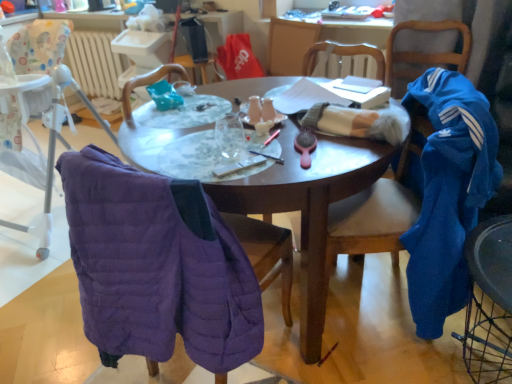
Question: Is velvet blue chair at right, arranged as the fourth chair when viewed from the left, wider than blue fleece jacket at right, the third chair viewed from the left?

Choices:
 (A) no
 (B) yes

Answer: (B)

Question: Is velvet blue chair at right, arranged as the fourth chair when viewed from the left, thinner than blue fleece jacket at right, positioned as the third chair in right-to-left order?

Choices:
 (A) no
 (B) yes

Answer: (A)

Question: From a real-world perspective, is velvet blue chair at right, which ranks as the 2th chair in right-to-left order, below blue fleece jacket at right, positioned as the third chair in right-to-left order?

Choices:
 (A) no
 (B) yes

Answer: (B)

Question: Is the depth of velvet blue chair at right, which ranks as the 2th chair in right-to-left order, greater than that of blue fleece jacket at right, positioned as the third chair in right-to-left order?

Choices:
 (A) yes
 (B) no

Answer: (B)

Question: Is velvet blue chair at right, which ranks as the 2th chair in right-to-left order, oriented away from blue fleece jacket at right, the third chair viewed from the left?

Choices:
 (A) no
 (B) yes

Answer: (A)

Question: Considering their positions, is red fabric bag at center located in front of or behind purple quilted jacket at left, which is counted as the 2th chair, starting from the left?

Choices:
 (A) behind
 (B) front

Answer: (A)

Question: Would you say red fabric bag at center is inside or outside purple quilted jacket at left, the 4th chair in the right-to-left sequence?

Choices:
 (A) outside
 (B) inside

Answer: (A)

Question: From a real-world perspective, is red fabric bag at center positioned above or below purple quilted jacket at left, which is counted as the 2th chair, starting from the left?

Choices:
 (A) below
 (B) above

Answer: (B)

Question: Based on their sizes in the image, would you say red fabric bag at center is bigger or smaller than purple quilted jacket at left, which is counted as the 2th chair, starting from the left?

Choices:
 (A) small
 (B) big

Answer: (A)

Question: Is white fuzzy blanket at center, which is the 1th clothing in left-to-right order, to the left or to the right of purple quilted vest at left, which appears as the 5th chair when viewed from the right, in the image?

Choices:
 (A) right
 (B) left

Answer: (A)

Question: Considering the positions of white fuzzy blanket at center, which is the second clothing from right to left, and purple quilted vest at left, acting as the 1th chair starting from the left, in the image, is white fuzzy blanket at center, which is the second clothing from right to left, wider or thinner than purple quilted vest at left, acting as the 1th chair starting from the left,?

Choices:
 (A) wide
 (B) thin

Answer: (B)

Question: From the image's perspective, is white fuzzy blanket at center, which is the second clothing from right to left, positioned above or below purple quilted vest at left, which appears as the 5th chair when viewed from the right?

Choices:
 (A) below
 (B) above

Answer: (A)

Question: From a real-world perspective, relative to purple quilted vest at left, acting as the 1th chair starting from the left, is white fuzzy blanket at center, which is the second clothing from right to left, vertically above or below?

Choices:
 (A) below
 (B) above

Answer: (B)

Question: In terms of height, does purple quilted jacket at left, the 4th chair in the right-to-left sequence, look taller or shorter compared to matte black pen at center?

Choices:
 (A) tall
 (B) short

Answer: (A)

Question: Considering their positions, is purple quilted jacket at left, which is counted as the 2th chair, starting from the left, located in front of or behind matte black pen at center?

Choices:
 (A) front
 (B) behind

Answer: (A)